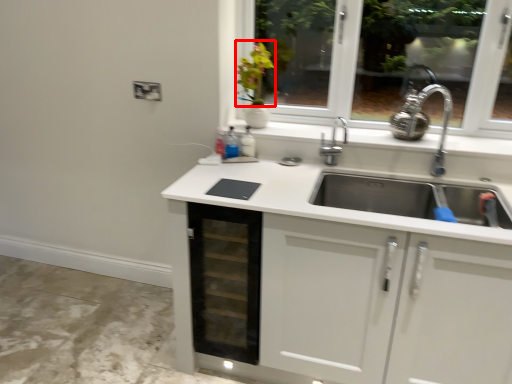
Question: Considering the relative positions of flower (annotated by the red box) and drawer in the image provided, where is flower (annotated by the red box) located with respect to the staircase?

Choices:
 (A) right
 (B) left

Answer: (A)